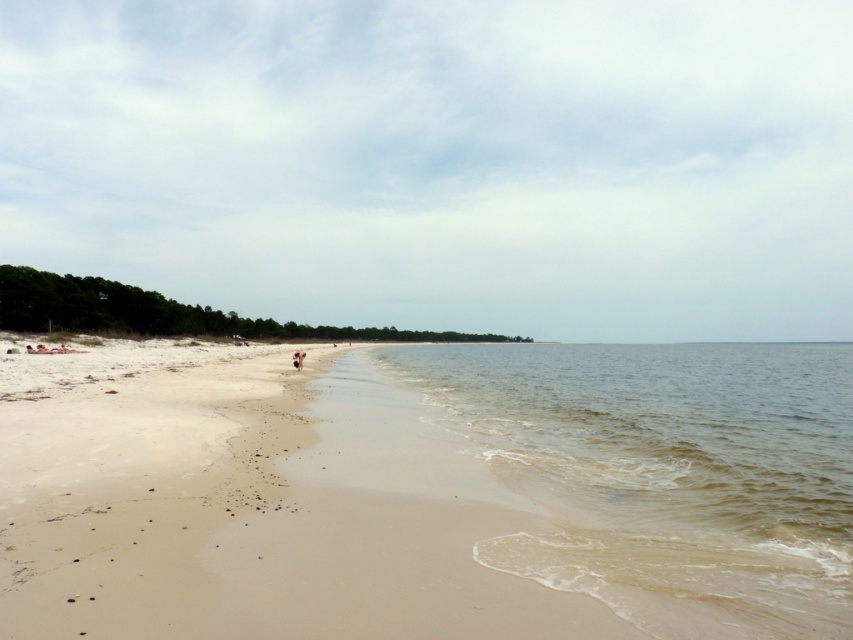
Looking at this image, you are standing at the point marked as point (253, 515) on the beach. Which direction should you walk to reach the sandy beach at lower left?

The sandy beach at lower left is located at point (253, 515), so you are already there.